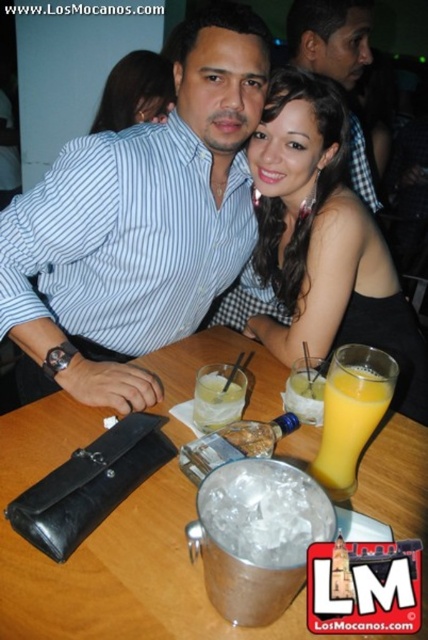
You are a photographer standing at the entrance of the bar. You want to take a photo of the striped cotton shirt at center and the shiny black dress at center. The minimum distance between the two subjects for your camera to focus properly is 30 centimeters. Based on the scene, will your camera be able to focus on both subjects simultaneously?

The striped cotton shirt at center and the shiny black dress at center are 25.92 centimeters apart, which is less than the required 30 centimeters. Therefore, the camera may struggle to focus on both subjects simultaneously due to the insufficient distance between them.

You are a bartender preparing to place a new drink order on the table. The table has limited space. Given the metallic silver bucket at center and the shiny black dress at center, which object should you avoid placing additional items near to maintain stability?

The metallic silver bucket at center has a larger width than the shiny black dress at center, so placing items near the metallic silver bucket at center would be more stable due to its wider base.

You are a bartender who needs to place a new drink order on the table. The drink must be placed between the metallic silver bucket at center and the shiny black dress at center. Which object should you place it closer to if the drink needs to be closer to the taller object?

The metallic silver bucket at center is not as tall as the shiny black dress at center, so you should place the drink closer to the shiny black dress at center since it is taller.